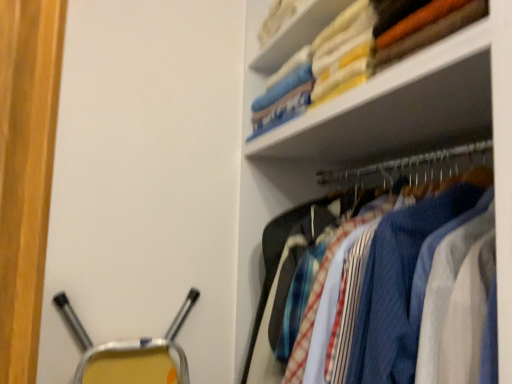
Question: Is white fabric at upper right to the right of soft cotton towels at upper right from the viewer's perspective?

Choices:
 (A) yes
 (B) no

Answer: (B)

Question: Does white fabric at upper right appear on the left side of soft cotton towels at upper right?

Choices:
 (A) no
 (B) yes

Answer: (B)

Question: Considering the relative sizes of white fabric at upper right and soft cotton towels at upper right in the image provided, is white fabric at upper right smaller than soft cotton towels at upper right?

Choices:
 (A) no
 (B) yes

Answer: (A)

Question: Is white fabric at upper right surrounding soft cotton towels at upper right?

Choices:
 (A) no
 (B) yes

Answer: (A)

Question: Is white fabric at upper right thinner than soft cotton towels at upper right?

Choices:
 (A) no
 (B) yes

Answer: (B)

Question: Is white fabric at upper right not within soft cotton towels at upper right?

Choices:
 (A) no
 (B) yes

Answer: (B)

Question: Can you confirm if textured fabric shirts at upper right is smaller than white fabric at upper right?

Choices:
 (A) no
 (B) yes

Answer: (A)

Question: Is textured fabric shirts at upper right taller than white fabric at upper right?

Choices:
 (A) no
 (B) yes

Answer: (B)

Question: Is textured fabric shirts at upper right oriented away from white fabric at upper right?

Choices:
 (A) yes
 (B) no

Answer: (B)

Question: Is textured fabric shirts at upper right positioned behind white fabric at upper right?

Choices:
 (A) no
 (B) yes

Answer: (A)

Question: From a real-world perspective, is textured fabric shirts at upper right positioned over white fabric at upper right based on gravity?

Choices:
 (A) no
 (B) yes

Answer: (A)

Question: Can you confirm if textured fabric shirts at upper right is positioned to the right of white fabric at upper right?

Choices:
 (A) yes
 (B) no

Answer: (A)

Question: Is white fabric at upper right facing towards textured fabric shirts at upper right?

Choices:
 (A) no
 (B) yes

Answer: (A)